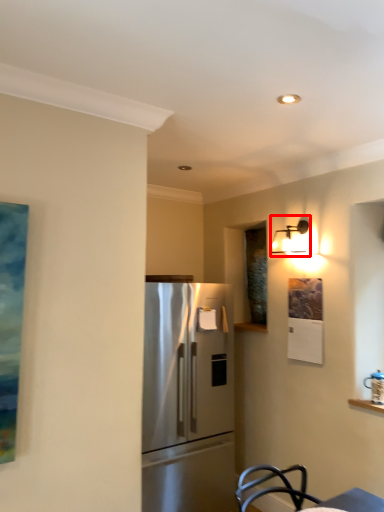
Question: From the image's perspective, considering the relative positions of light fixture (annotated by the red box) and refrigerator in the image provided, where is light fixture (annotated by the red box) located with respect to the staircase?

Choices:
 (A) above
 (B) below

Answer: (A)